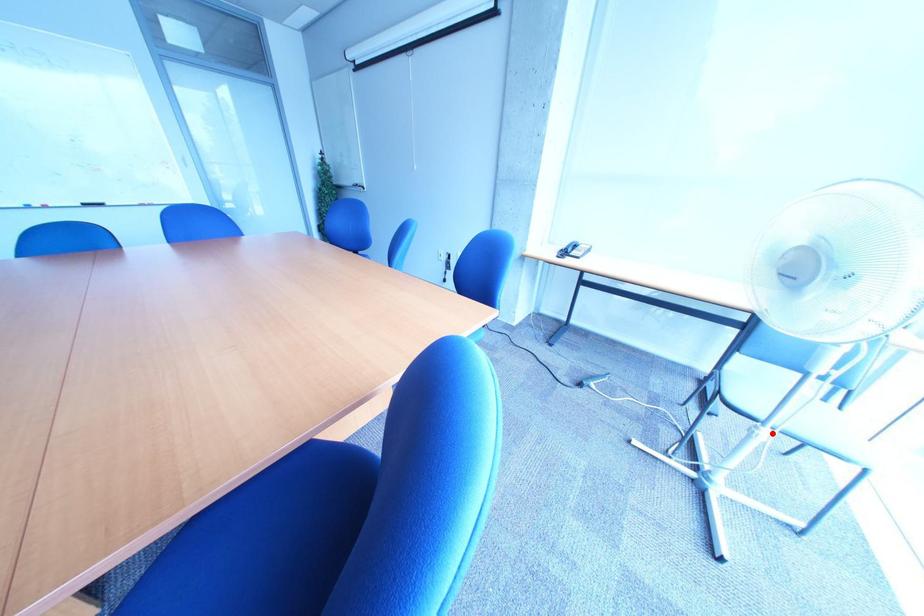
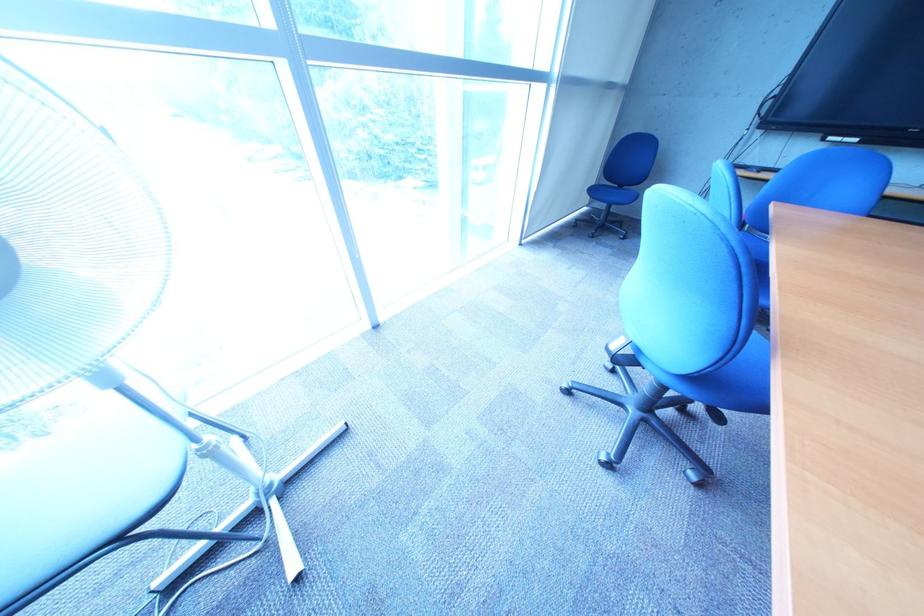
Find the pixel in the second image that matches the highlighted location in the first image.

(229, 445)